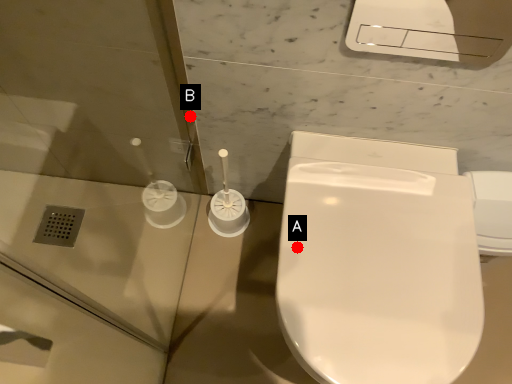
Question: Two points are circled on the image, labeled by A and B beside each circle. Among these points, which one is farthest from the camera?

Choices:
 (A) A is further
 (B) B is further

Answer: (B)